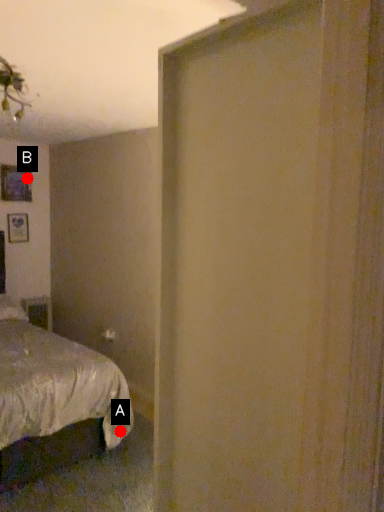
Question: Two points are circled on the image, labeled by A and B beside each circle. Which point appears farthest from the camera in this image?

Choices:
 (A) A is further
 (B) B is further

Answer: (B)